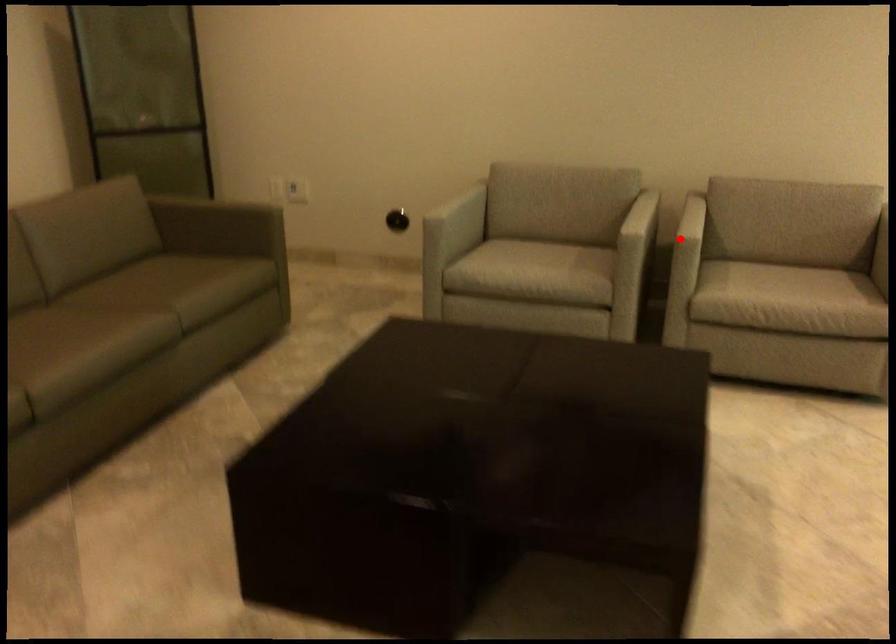
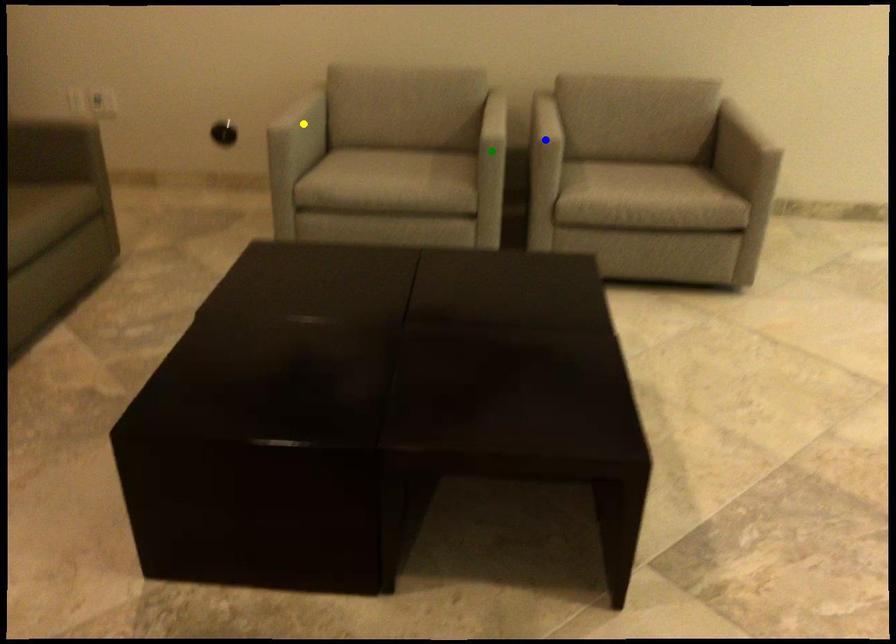
Question: I am providing you with two images of the same scene from different viewpoints. A red point is marked on the first image. You are given multiple points on the second image. Which point in image 2 represents the same 3d spot as the red point in image 1?

Choices:
 (A) blue point
 (B) green point
 (C) yellow point

Answer: (A)